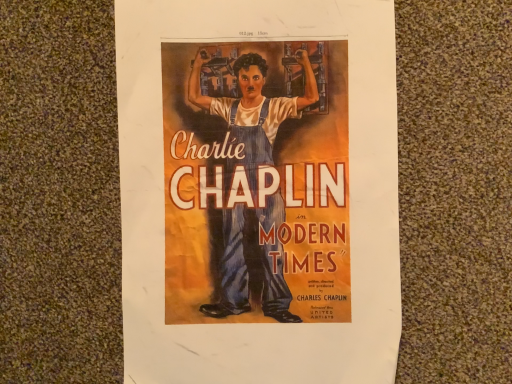
Measure the distance between point (138, 69) and camera.

Point (138, 69) and camera are 12.60 inches apart.

The width and height of the screenshot is (512, 384). In order to click on matte blue overalls at center in this screenshot , I will do `click(258, 191)`.

What do you see at coordinates (258, 191) in the screenshot?
I see `matte blue overalls at center` at bounding box center [258, 191].

Locate an element on the screen. The image size is (512, 384). matte blue overalls at center is located at coordinates (258, 191).